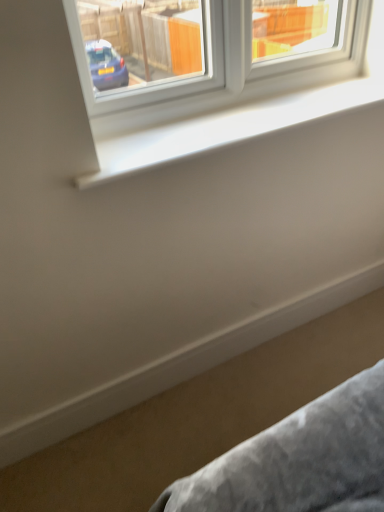
What is the approximate height of white smooth window sill at upper center?

white smooth window sill at upper center is 1.95 inches in height.

Describe the element at coordinates (229, 127) in the screenshot. I see `white smooth window sill at upper center` at that location.

Find the location of `white smooth window sill at upper center`. white smooth window sill at upper center is located at coordinates (229, 127).

Locate an element on the screen. The image size is (384, 512). white smooth window sill at upper center is located at coordinates (229, 127).